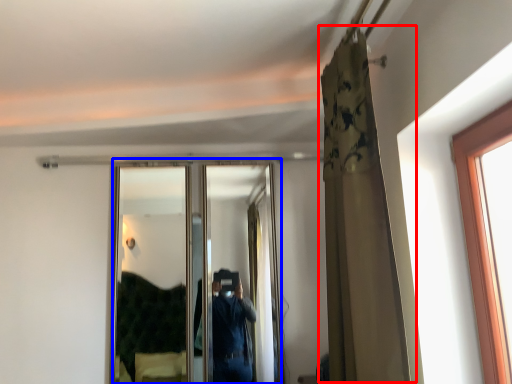
Question: Which of the following is the closest to the observer, curtain (highlighted by a red box) or mirror (highlighted by a blue box)?

Choices:
 (A) curtain
 (B) mirror

Answer: (A)